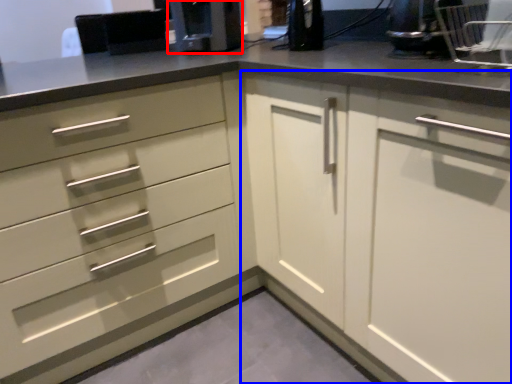
Question: Which object is closer to the camera taking this photo, coffee machine (highlighted by a red box) or cabinetry (highlighted by a blue box)?

Choices:
 (A) coffee machine
 (B) cabinetry

Answer: (B)